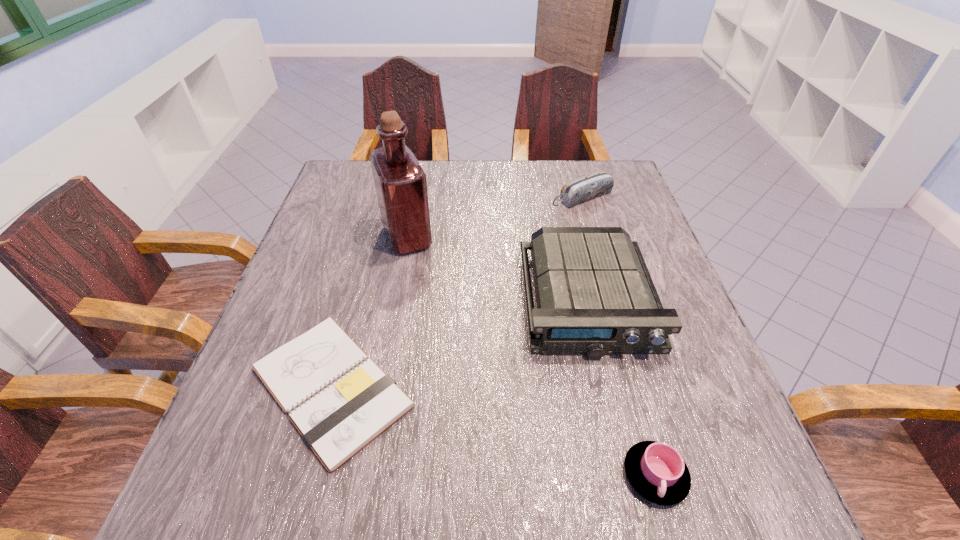
Image resolution: width=960 pixels, height=540 pixels. In order to click on vacant point at the far edge in this screenshot , I will do `click(498, 198)`.

You are a GUI agent. You are given a task and a screenshot of the screen. Output one action in this format:
    pyautogui.click(x=<x>, y=<y>)
    Task: Click on the blank space at the near edge
    Image resolution: width=960 pixels, height=540 pixels.
    Given the screenshot: What is the action you would take?
    tap(348, 485)

This screenshot has width=960, height=540. In the image, there is a desktop. What are the coordinates of `free space at the left edge` in the screenshot? It's located at (361, 211).

Locate an element on the screen. This screenshot has width=960, height=540. vacant space at the right edge is located at coordinates (592, 224).

The height and width of the screenshot is (540, 960). In the image, there is a desktop. Identify the location of vacant space at the far left corner. (338, 178).

The height and width of the screenshot is (540, 960). In order to click on free space at the near left corner of the desktop in this screenshot , I will do `click(174, 528)`.

In order to click on vacant space at the far right corner of the desktop in this screenshot , I will do `click(583, 171)`.

This screenshot has width=960, height=540. Identify the location of empty space that is in between the tallest object and the second tallest object. (497, 269).

Where is `empty location between the farthest object and the shortest object`? Image resolution: width=960 pixels, height=540 pixels. empty location between the farthest object and the shortest object is located at coordinates (456, 292).

The image size is (960, 540). Identify the location of unoccupied area between the second shortest object and the tallest object. (531, 356).